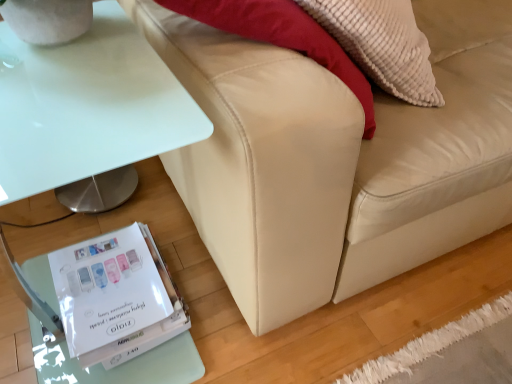
Question: Can you confirm if beige leather couch at lower right is wider than white glossy table at lower left?

Choices:
 (A) yes
 (B) no

Answer: (A)

Question: Is white glossy table at lower left surrounded by beige leather couch at lower right?

Choices:
 (A) no
 (B) yes

Answer: (A)

Question: Is beige leather couch at lower right bigger than white glossy table at lower left?

Choices:
 (A) no
 (B) yes

Answer: (B)

Question: From the image's perspective, is beige leather couch at lower right located beneath white glossy table at lower left?

Choices:
 (A) yes
 (B) no

Answer: (B)

Question: Is beige leather couch at lower right thinner than white glossy table at lower left?

Choices:
 (A) yes
 (B) no

Answer: (B)

Question: Is beige leather couch at lower right in front of or behind white glossy table at lower left in the image?

Choices:
 (A) front
 (B) behind

Answer: (A)

Question: From the image's perspective, is beige leather couch at lower right positioned above or below white glossy table at lower left?

Choices:
 (A) above
 (B) below

Answer: (A)

Question: In terms of width, does beige leather couch at lower right look wider or thinner when compared to white glossy table at lower left?

Choices:
 (A) thin
 (B) wide

Answer: (B)

Question: Based on their sizes in the image, would you say beige leather couch at lower right is bigger or smaller than white glossy table at lower left?

Choices:
 (A) small
 (B) big

Answer: (B)

Question: In terms of size, does white glossy paperback book at lower left appear bigger or smaller than beige leather couch at lower right?

Choices:
 (A) big
 (B) small

Answer: (B)

Question: Would you say white glossy paperback book at lower left is to the left or to the right of beige leather couch at lower right in the picture?

Choices:
 (A) left
 (B) right

Answer: (A)

Question: From their relative heights in the image, would you say white glossy paperback book at lower left is taller or shorter than beige leather couch at lower right?

Choices:
 (A) tall
 (B) short

Answer: (B)

Question: From a real-world perspective, relative to beige leather couch at lower right, is white glossy paperback book at lower left vertically above or below?

Choices:
 (A) above
 (B) below

Answer: (B)

Question: Looking at their shapes, would you say white glossy table at lower left is wider or thinner than white glossy paperback book at lower left?

Choices:
 (A) thin
 (B) wide

Answer: (B)

Question: Would you say white glossy table at lower left is inside or outside white glossy paperback book at lower left?

Choices:
 (A) inside
 (B) outside

Answer: (B)